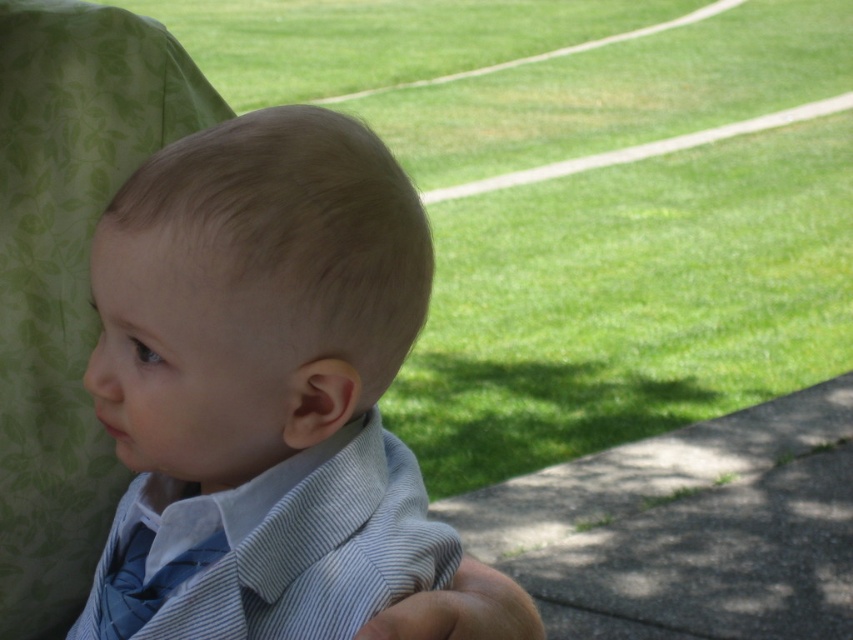
Question: Estimate the real-world distances between objects in this image. Which object is farther from the blue striped dress shirt at center?

Choices:
 (A) light brown hair at center
 (B) blue striped tie at lower left

Answer: (B)

Question: Is blue striped dress shirt at center smaller than blue striped tie at lower left?

Choices:
 (A) no
 (B) yes

Answer: (A)

Question: Can you confirm if light brown hair at center is wider than blue striped tie at lower left?

Choices:
 (A) yes
 (B) no

Answer: (A)

Question: Which point is farther to the camera?

Choices:
 (A) (369, 600)
 (B) (112, 604)

Answer: (B)

Question: Is light brown hair at center to the right of blue striped dress shirt at center from the viewer's perspective?

Choices:
 (A) yes
 (B) no

Answer: (A)

Question: Which object is closer to the camera taking this photo?

Choices:
 (A) light brown hair at center
 (B) blue striped tie at lower left
 (C) blue striped dress shirt at center

Answer: (A)